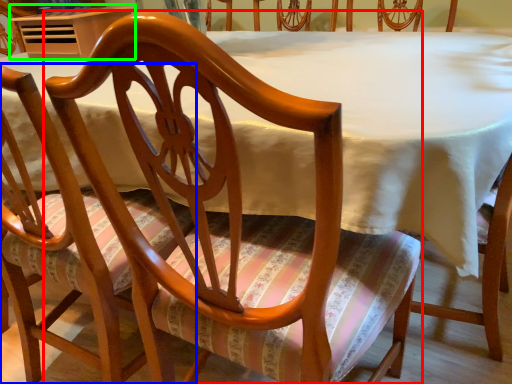
Question: Which object is the farthest from chair (highlighted by a red box)? Choose among these: chair (highlighted by a blue box) or table (highlighted by a green box).

Choices:
 (A) chair
 (B) table

Answer: (B)